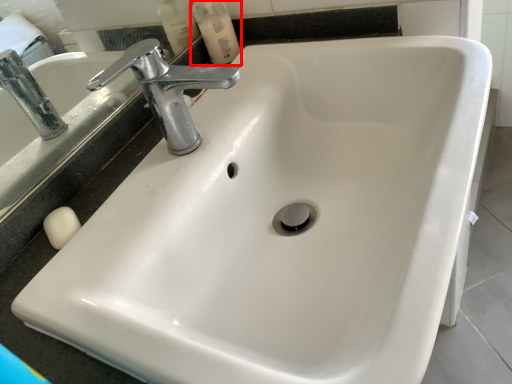
Question: Considering the relative positions of mouthwash (annotated by the red box) and tap in the image provided, where is mouthwash (annotated by the red box) located with respect to the staircase?

Choices:
 (A) right
 (B) left

Answer: (B)